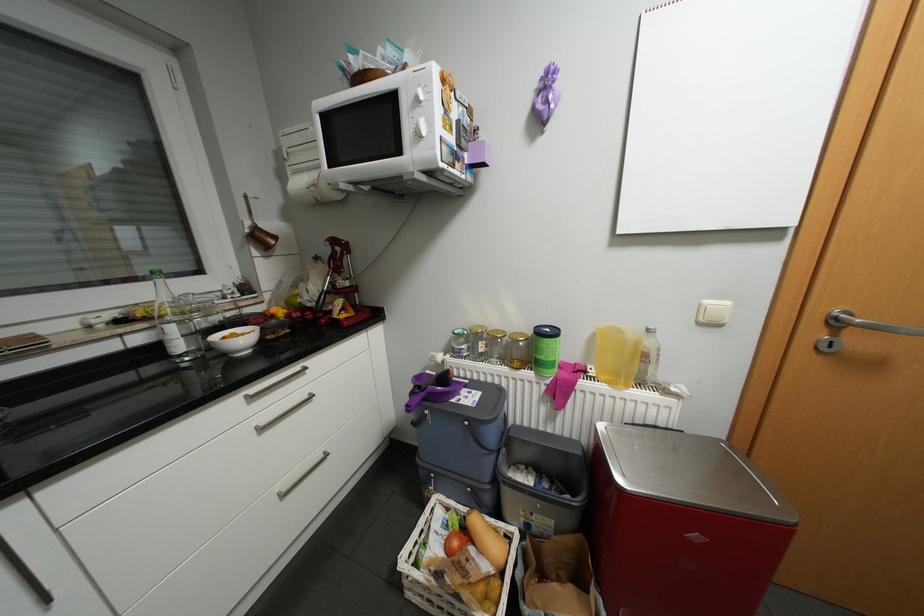
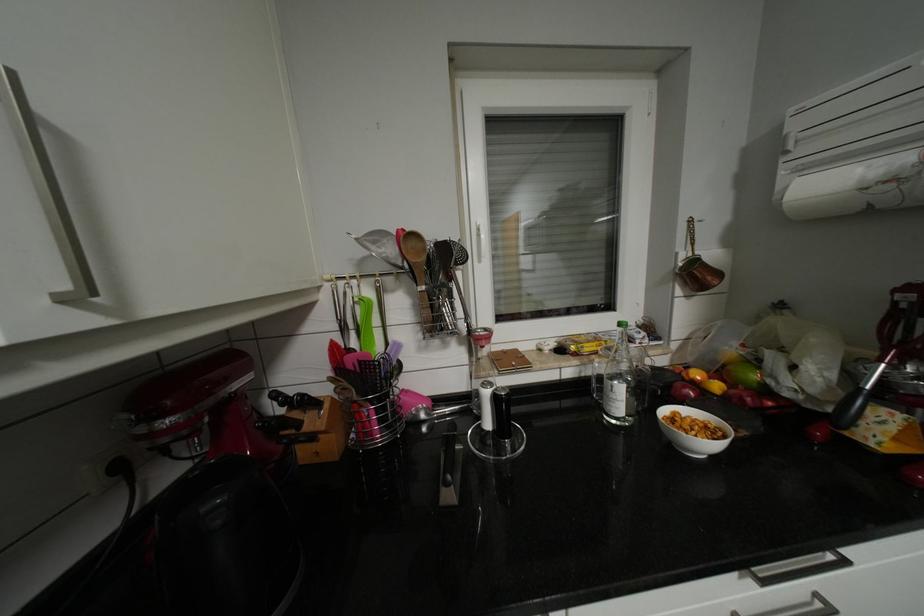
Find the pixel in the second image that matches point (282, 309) in the first image.

(704, 374)